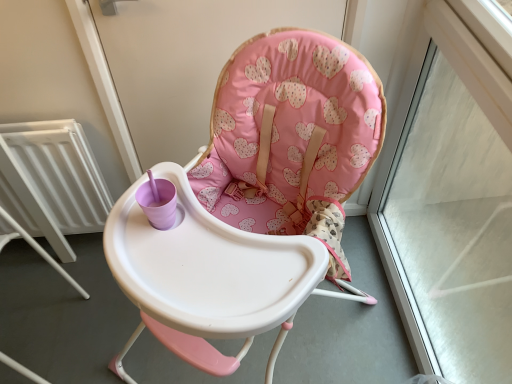
Image resolution: width=512 pixels, height=384 pixels. Describe the element at coordinates (451, 194) in the screenshot. I see `transparent glass window frame at upper right` at that location.

The width and height of the screenshot is (512, 384). Describe the element at coordinates (291, 138) in the screenshot. I see `pink fabric highchair at center` at that location.

Identify the location of white metallic radiator at left. (54, 179).

The width and height of the screenshot is (512, 384). Find the location of `transparent glass window frame at upper right`. transparent glass window frame at upper right is located at coordinates (451, 194).

In the scene shown: Considering the relative positions of pink fabric highchair at center and pink fabric screen door at upper center in the image provided, is pink fabric highchair at center to the right of pink fabric screen door at upper center from the viewer's perspective?

Correct, you'll find pink fabric highchair at center to the right of pink fabric screen door at upper center.

Is pink fabric highchair at center in contact with pink fabric screen door at upper center?

No.

Can we say pink fabric highchair at center lies outside pink fabric screen door at upper center?

That's correct, pink fabric highchair at center is outside of pink fabric screen door at upper center.

Is pink fabric highchair at center facing away from pink fabric screen door at upper center?

pink fabric highchair at center does not have its back to pink fabric screen door at upper center.

Does point (96, 9) lie behind point (476, 178)?

No, (96, 9) is closer to viewer.

From their relative heights in the image, would you say pink fabric screen door at upper center is taller or shorter than transparent glass window frame at upper right?

In the image, pink fabric screen door at upper center appears to be shorter than transparent glass window frame at upper right.

How distant is pink fabric screen door at upper center from transparent glass window frame at upper right?

They are 74.28 centimeters apart.

How different are the orientations of pink fabric screen door at upper center and transparent glass window frame at upper right in degrees?

There is a 89.4-degree angle between the facing directions of pink fabric screen door at upper center and transparent glass window frame at upper right.

Would you consider pink fabric highchair at center to be distant from transparent glass window frame at upper right?

No, there isn't a large distance between pink fabric highchair at center and transparent glass window frame at upper right.

Is pink fabric highchair at center oriented away from transparent glass window frame at upper right?

pink fabric highchair at center does not have its back to transparent glass window frame at upper right.

How distant is pink fabric highchair at center from transparent glass window frame at upper right?

pink fabric highchair at center and transparent glass window frame at upper right are 61.48 centimeters apart.

Which object is wider, pink fabric highchair at center or transparent glass window frame at upper right?

pink fabric highchair at center.

Between pink fabric highchair at center and white metallic radiator at left, which one appears on the right side from the viewer's perspective?

Positioned to the right is pink fabric highchair at center.

This screenshot has height=384, width=512. Find the location of `radiator below the pink fabric highchair at center (from a real-world perspective)`. radiator below the pink fabric highchair at center (from a real-world perspective) is located at coordinates (54, 179).

Does point (270, 33) appear closer or farther from the camera than point (41, 163)?

Clearly, point (270, 33) is closer to the camera than point (41, 163).

Would you say pink fabric highchair at center is a long distance from white metallic radiator at left?

That's not correct — pink fabric highchair at center is a little close to white metallic radiator at left.

Who is shorter, transparent glass window frame at upper right or pink fabric highchair at center?

With less height is pink fabric highchair at center.

Is transparent glass window frame at upper right next to pink fabric highchair at center and touching it?

No, transparent glass window frame at upper right is not in contact with pink fabric highchair at center.

Is transparent glass window frame at upper right facing towards pink fabric highchair at center?

Yes, transparent glass window frame at upper right is aimed at pink fabric highchair at center.

Is transparent glass window frame at upper right spatially inside pink fabric highchair at center, or outside of it?

transparent glass window frame at upper right is outside pink fabric highchair at center.

Is pink fabric screen door at upper center to the right of white metallic radiator at left from the viewer's perspective?

Correct, you'll find pink fabric screen door at upper center to the right of white metallic radiator at left.

Is pink fabric screen door at upper center facing away from white metallic radiator at left?

No, pink fabric screen door at upper center is not facing the opposite direction of white metallic radiator at left.

Is pink fabric screen door at upper center directly adjacent to white metallic radiator at left?

pink fabric screen door at upper center and white metallic radiator at left are clearly separated.

Is white metallic radiator at left aimed at transparent glass window frame at upper right?

No, white metallic radiator at left is not aimed at transparent glass window frame at upper right.

From the image's perspective, which is above, white metallic radiator at left or transparent glass window frame at upper right?

white metallic radiator at left, from the image's perspective.

Is white metallic radiator at left beside transparent glass window frame at upper right?

white metallic radiator at left and transparent glass window frame at upper right are clearly separated.

Where is `chair in front of the pink fabric screen door at upper center`? This screenshot has height=384, width=512. chair in front of the pink fabric screen door at upper center is located at coordinates pos(291,138).

This screenshot has height=384, width=512. In order to click on screen door on the left of transparent glass window frame at upper right in this screenshot , I will do `click(187, 60)`.

Estimate the real-world distances between objects in this image. Which object is further from transparent glass window frame at upper right, white metallic radiator at left or pink fabric highchair at center?

white metallic radiator at left.

Based on their spatial positions, is transparent glass window frame at upper right or white metallic radiator at left closer to pink fabric screen door at upper center?

white metallic radiator at left lies closer to pink fabric screen door at upper center than the other object.

Based on their spatial positions, is pink fabric highchair at center or transparent glass window frame at upper right further from pink fabric screen door at upper center?

transparent glass window frame at upper right lies further to pink fabric screen door at upper center than the other object.

Estimate the real-world distances between objects in this image. Which object is closer to white metallic radiator at left, pink fabric screen door at upper center or transparent glass window frame at upper right?

The object closer to white metallic radiator at left is pink fabric screen door at upper center.

In the scene shown: From the image, which object appears to be farther from white metallic radiator at left, transparent glass window frame at upper right or pink fabric highchair at center?

transparent glass window frame at upper right is positioned further to the anchor white metallic radiator at left.

When comparing their distances from transparent glass window frame at upper right, does pink fabric highchair at center or white metallic radiator at left seem closer?

Among the two, pink fabric highchair at center is located nearer to transparent glass window frame at upper right.

Estimate the real-world distances between objects in this image. Which object is further from white metallic radiator at left, transparent glass window frame at upper right or pink fabric screen door at upper center?

Among the two, transparent glass window frame at upper right is located further to white metallic radiator at left.

Estimate the real-world distances between objects in this image. Which object is further from pink fabric screen door at upper center, white metallic radiator at left or pink fabric highchair at center?

pink fabric highchair at center.

I want to click on window frame between pink fabric highchair at center and pink fabric screen door at upper center along the z-axis, so click(451, 194).

Image resolution: width=512 pixels, height=384 pixels. What are the coordinates of `screen door located between pink fabric highchair at center and white metallic radiator at left in the depth direction` in the screenshot? It's located at (187, 60).

This screenshot has width=512, height=384. I want to click on screen door between white metallic radiator at left and transparent glass window frame at upper right in the horizontal direction, so click(x=187, y=60).

This screenshot has height=384, width=512. I want to click on chair situated between white metallic radiator at left and transparent glass window frame at upper right from left to right, so click(x=291, y=138).